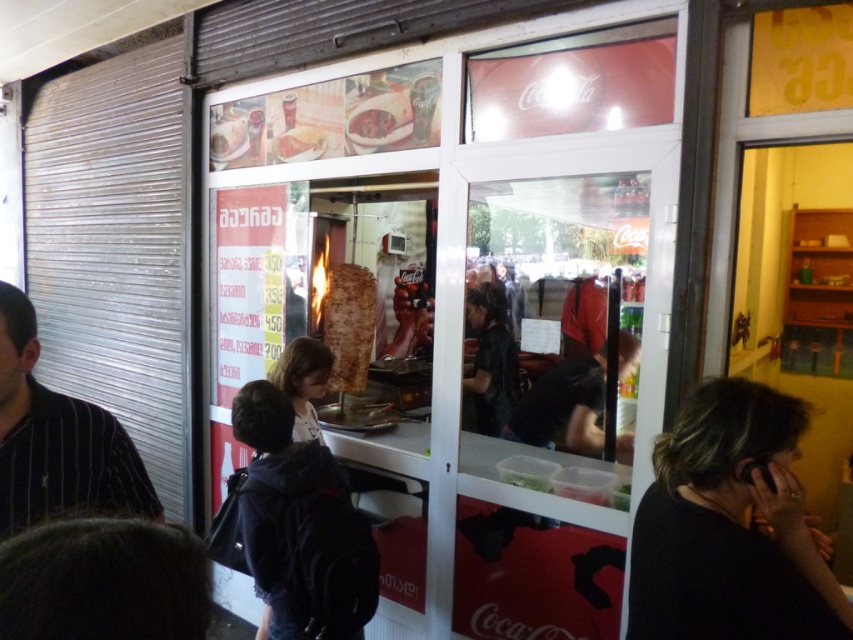
Question: Can you confirm if sliced meat at center is positioned below shiny silver doner at center?

Choices:
 (A) no
 (B) yes

Answer: (A)

Question: Can you confirm if transparent glass door at center is positioned to the right of dark gray fabric jacket at center?

Choices:
 (A) no
 (B) yes

Answer: (B)

Question: Which object is closer to the camera taking this photo?

Choices:
 (A) transparent glass door at center
 (B) dark brown hair at center
 (C) dark brown hair at lower left
 (D) dark blue jacket at center

Answer: (C)

Question: Which of the following is the closest to the observer?

Choices:
 (A) (337, 349)
 (B) (297, 486)
 (C) (322, 346)

Answer: (B)

Question: Can you confirm if black fabric at right is positioned to the left of dark blue jacket at center?

Choices:
 (A) no
 (B) yes

Answer: (A)

Question: Which point appears farthest from the camera in this image?

Choices:
 (A) (401, 282)
 (B) (668, 564)

Answer: (A)